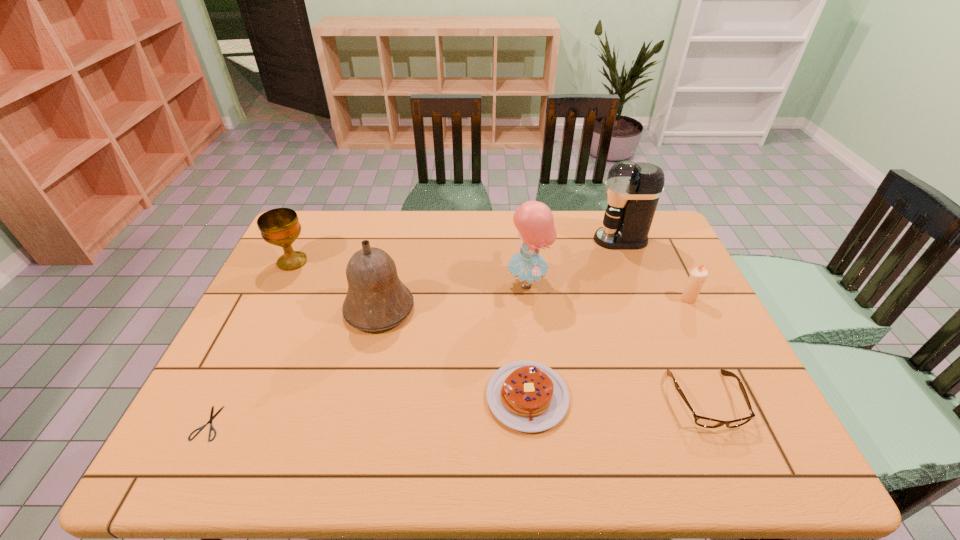
Where is `coffee maker at the far edge`? coffee maker at the far edge is located at coordinates pos(633,190).

Locate an element on the screen. The width and height of the screenshot is (960, 540). chalice at the far edge is located at coordinates (280, 227).

Locate an element on the screen. The height and width of the screenshot is (540, 960). spectacles at the near edge is located at coordinates (705, 422).

The width and height of the screenshot is (960, 540). Find the location of `pancake at the near edge`. pancake at the near edge is located at coordinates (527, 396).

The image size is (960, 540). Identify the location of shears that is at the near edge. pyautogui.click(x=212, y=417).

The height and width of the screenshot is (540, 960). In order to click on chalice situated at the left edge in this screenshot , I will do `click(280, 227)`.

This screenshot has width=960, height=540. In order to click on shears that is positioned at the left edge in this screenshot , I will do `click(212, 417)`.

Identify the location of coffee maker located in the right edge section of the desktop. (633, 190).

At what (x,y) coordinates should I click in order to perform the action: click on candle that is at the right edge. Please return your answer as a coordinate pair (x, y). Looking at the image, I should click on (698, 275).

At what (x,y) coordinates should I click in order to perform the action: click on spectacles positioned at the right edge. Please return your answer as a coordinate pair (x, y). Looking at the image, I should click on (705, 422).